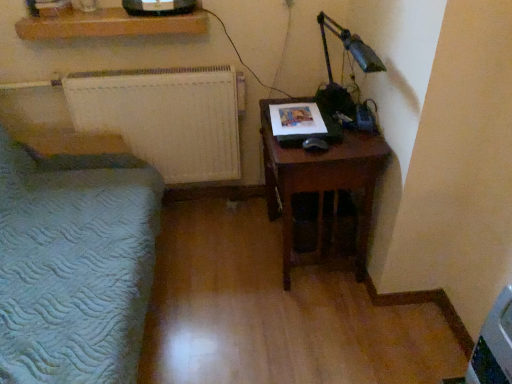
Question: Would you consider brown wooden nightstand at right to be distant from wooden shelf at upper center?

Choices:
 (A) no
 (B) yes

Answer: (A)

Question: Is brown wooden nightstand at right oriented towards wooden shelf at upper center?

Choices:
 (A) no
 (B) yes

Answer: (A)

Question: Is wooden shelf at upper center inside brown wooden nightstand at right?

Choices:
 (A) yes
 (B) no

Answer: (B)

Question: From the image's perspective, is brown wooden nightstand at right beneath wooden shelf at upper center?

Choices:
 (A) yes
 (B) no

Answer: (A)

Question: From a real-world perspective, is brown wooden nightstand at right physically below wooden shelf at upper center?

Choices:
 (A) no
 (B) yes

Answer: (B)

Question: Looking at their shapes, would you say wooden shelf at upper center is wider or thinner than brown wooden nightstand at right?

Choices:
 (A) thin
 (B) wide

Answer: (A)

Question: Does point (34, 36) appear closer or farther from the camera than point (320, 228)?

Choices:
 (A) farther
 (B) closer

Answer: (A)

Question: Is wooden shelf at upper center to the left or to the right of brown wooden nightstand at right in the image?

Choices:
 (A) left
 (B) right

Answer: (A)

Question: Would you say wooden shelf at upper center is inside or outside brown wooden nightstand at right?

Choices:
 (A) outside
 (B) inside

Answer: (A)

Question: Considering the positions of point (100, 284) and point (269, 162), is point (100, 284) closer or farther from the camera than point (269, 162)?

Choices:
 (A) closer
 (B) farther

Answer: (A)

Question: From their relative heights in the image, would you say white textured radiator at left is taller or shorter than brown wooden nightstand at right?

Choices:
 (A) short
 (B) tall

Answer: (B)

Question: In terms of size, does white textured radiator at left appear bigger or smaller than brown wooden nightstand at right?

Choices:
 (A) big
 (B) small

Answer: (A)

Question: Visually, is white textured radiator at left positioned to the left or to the right of brown wooden nightstand at right?

Choices:
 (A) right
 (B) left

Answer: (B)

Question: Relative to wooden shelf at upper center, is brown wooden nightstand at right in front or behind?

Choices:
 (A) behind
 (B) front

Answer: (B)

Question: From a real-world perspective, is brown wooden nightstand at right physically located above or below wooden shelf at upper center?

Choices:
 (A) below
 (B) above

Answer: (A)